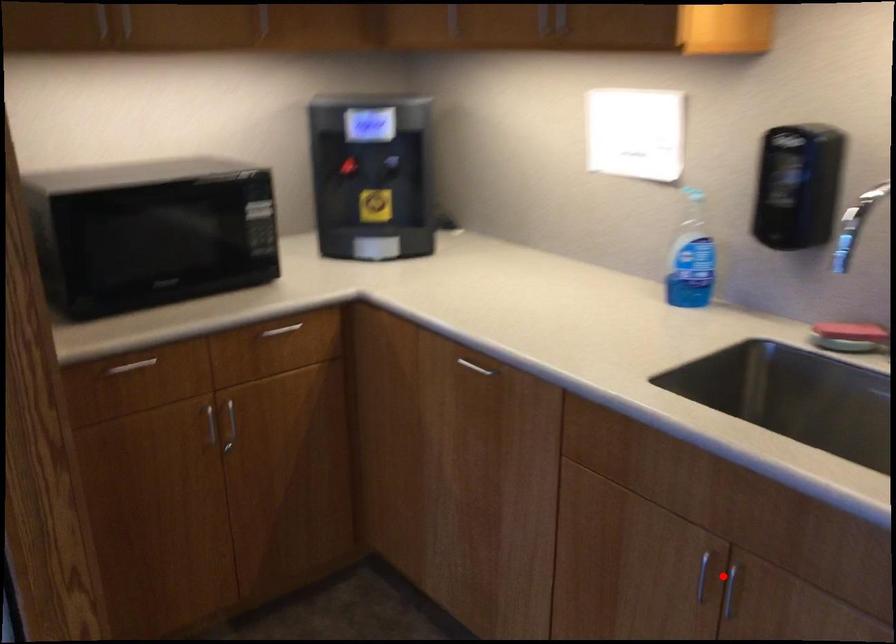
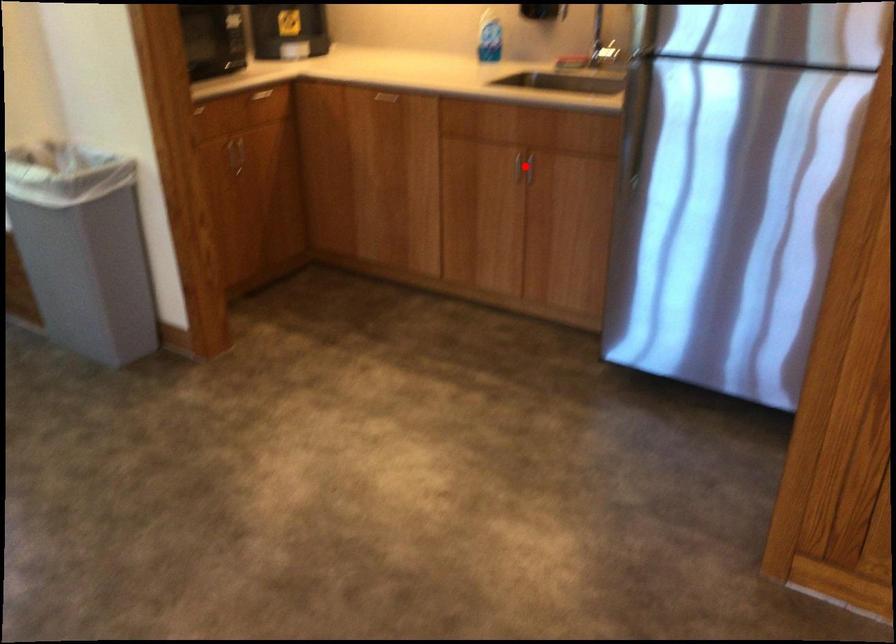
I am providing you with two images of the same scene from different viewpoints. A red point is marked on the first image and another point is marked on the second image. Does the point marked in image1 correspond to the same location as the one in image2?

Yes